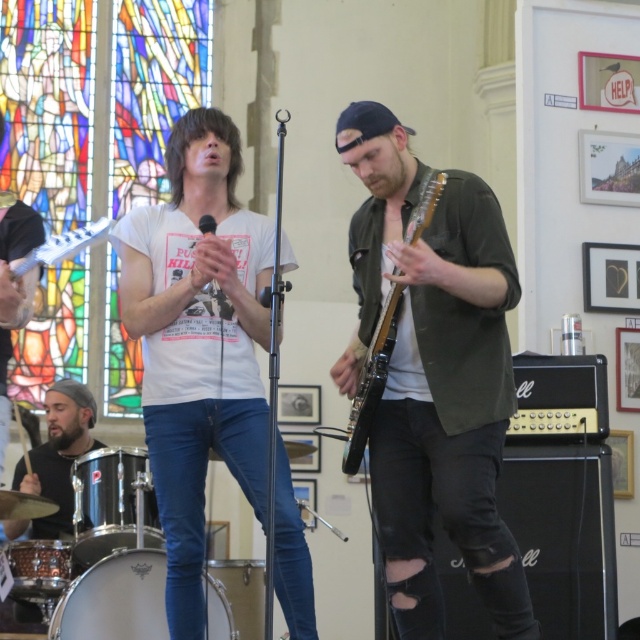
You are sitting in the audience and want to know which of the two points, point (486, 564) or point (400, 314), is closer to you. Can you determine this based on the image?

Point (486, 564) is closer to the viewer than point (400, 314).

You are a photographer standing at the back of the venue. You want to take a closeup shot of the silver metallic drum at lower left. Given that your camera can focus up to 50 meters, will you be able to capture a clear image?

The silver metallic drum at lower left is 51.51 meters away from the viewer. Since your camera can only focus up to 50 meters, you won not be able to capture a clear image of the drum.